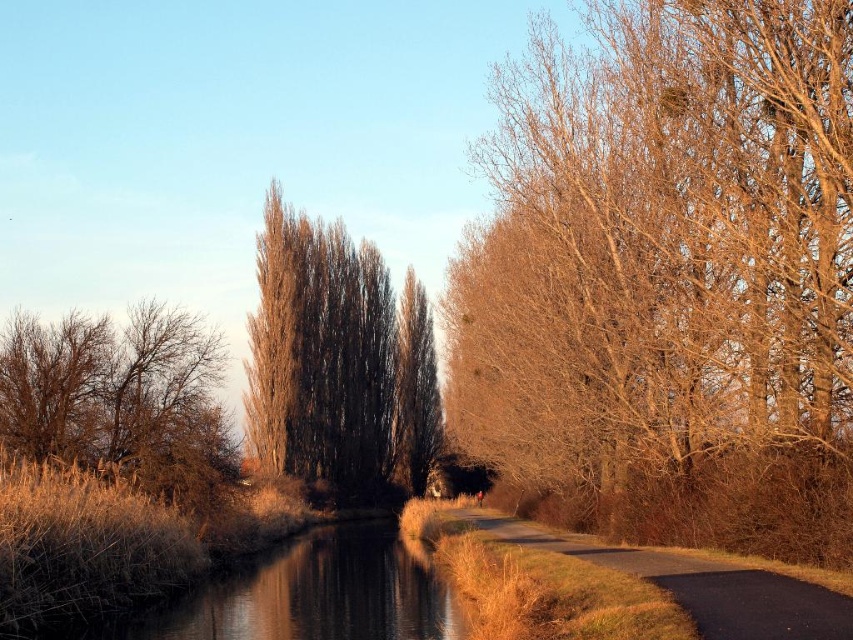
You are standing at the edge of the waterway in the scene. You see two points marked on the image, point (x=715, y=348) and point (x=164, y=620). Which point is nearer to your current position?

Point (x=715, y=348) is closer to the camera than point (x=164, y=620), so the point (x=715, y=348) is nearer to your current position.